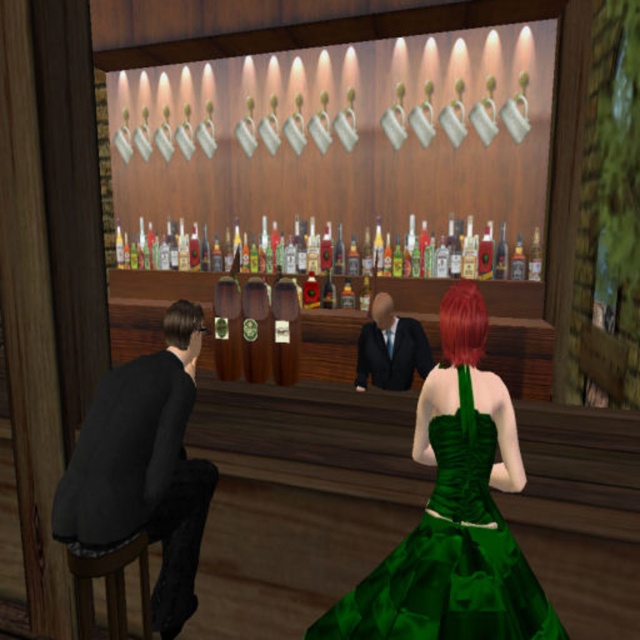
Question: Which point is farther to the camera?

Choices:
 (A) (168, 314)
 (B) (76, 460)
 (C) (403, 353)

Answer: (C)

Question: Does green satin dress at center come behind shiny red hair at center?

Choices:
 (A) yes
 (B) no

Answer: (B)

Question: Considering the relative positions of shiny red hair at center and brown matte hair at left in the image provided, where is shiny red hair at center located with respect to brown matte hair at left?

Choices:
 (A) left
 (B) right

Answer: (B)

Question: Which object is farther from the camera taking this photo?

Choices:
 (A) green satin dress at center
 (B) brown matte hair at left

Answer: (B)

Question: Is green satin dress at center further to camera compared to brown wood bar stool at lower left?

Choices:
 (A) no
 (B) yes

Answer: (A)

Question: Which point is farther to the camera?

Choices:
 (A) (193, 305)
 (B) (86, 506)
 (C) (465, 324)

Answer: (A)